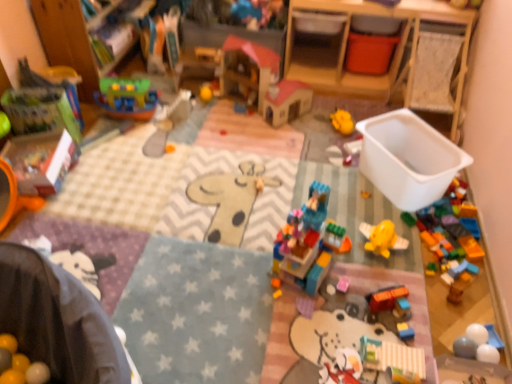
Question: Based on their sizes in the image, would you say wooden dollhouse at center, which is counted as the 9th toy, starting from the bottom, is bigger or smaller than orange matte car at center, arranged as the ninth toy when viewed from the top?

Choices:
 (A) big
 (B) small

Answer: (A)

Question: From their relative heights in the image, would you say wooden dollhouse at center, which is counted as the 9th toy, starting from the bottom, is taller or shorter than orange matte car at center, the 2th toy from the bottom?

Choices:
 (A) short
 (B) tall

Answer: (B)

Question: Estimate the real-world distances between objects in this image. Which object is closer to the yellow rubber duck at center, acting as the 6th toy starting from the top?

Choices:
 (A) wooden toy at upper left
 (B) matte green book at left, acting as the 5th toy starting from the top
 (C) yellow matte ball at center, which is the 8th toy from bottom to top
 (D) wooden dollhouse at center, which is counted as the 9th toy, starting from the bottom
 (E) pastel striped blocks at center, which appears as the 10th toy when viewed from the top

Answer: (D)

Question: Which of these objects is positioned farthest from the wooden changing table at upper right?

Choices:
 (A) orange matte car at center, the 2th toy from the bottom
 (B) yellow rubber duck at center, which appears as the fifth toy when ordered from the bottom
 (C) wooden toy at upper left
 (D) translucent plastic castle at center, marked as the third toy in a bottom-to-top arrangement
 (E) translucent plastic boat at upper left, the 4th toy viewed from the top

Answer: (A)